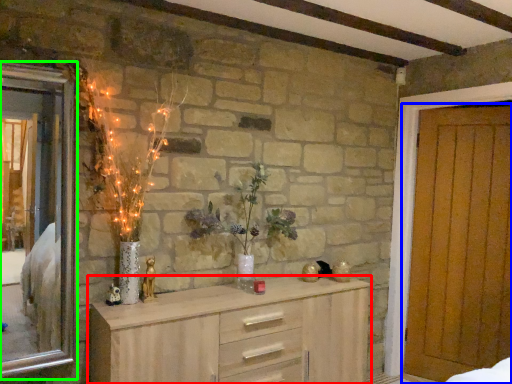
Question: Which is nearer to the chest of drawers (highlighted by a red box)? door (highlighted by a blue box) or window (highlighted by a green box).

Choices:
 (A) door
 (B) window

Answer: (A)